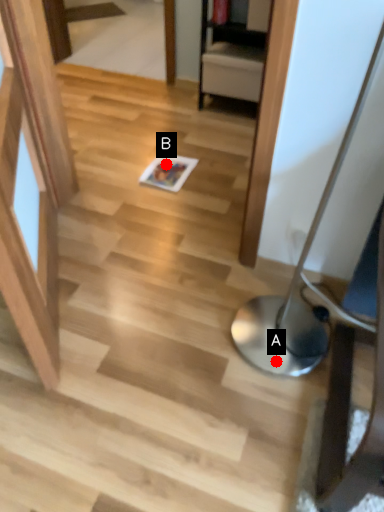
Question: Two points are circled on the image, labeled by A and B beside each circle. Which point is further to the camera?

Choices:
 (A) A is further
 (B) B is further

Answer: (B)